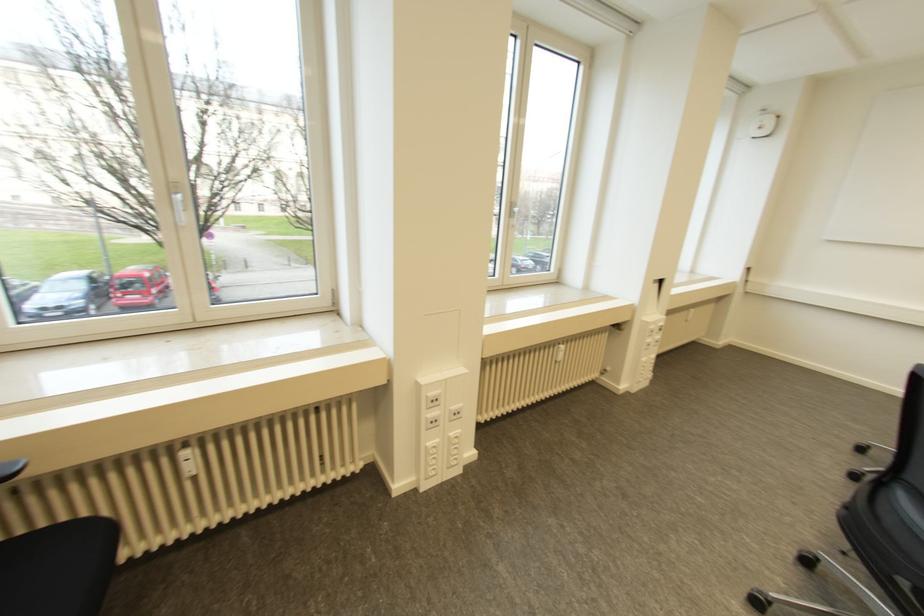
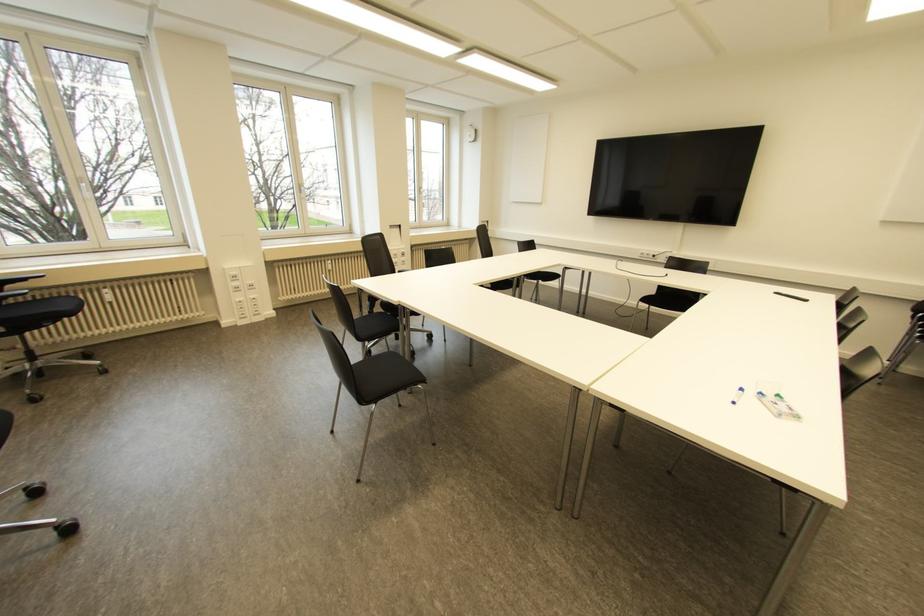
The point at [431,392] is marked in the first image. Where is the corresponding point in the second image?

(232, 273)